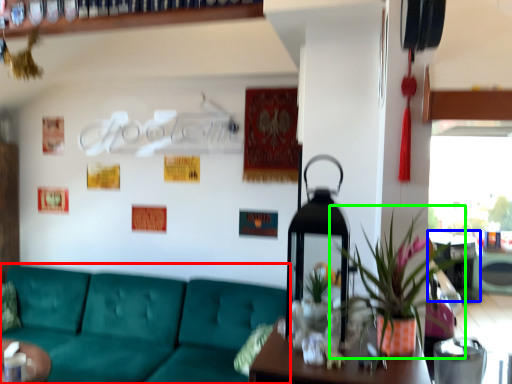
Question: Considering the real-world distances, which object is closest to studio couch (highlighted by a red box)? table (highlighted by a blue box) or houseplant (highlighted by a green box).

Choices:
 (A) table
 (B) houseplant

Answer: (B)